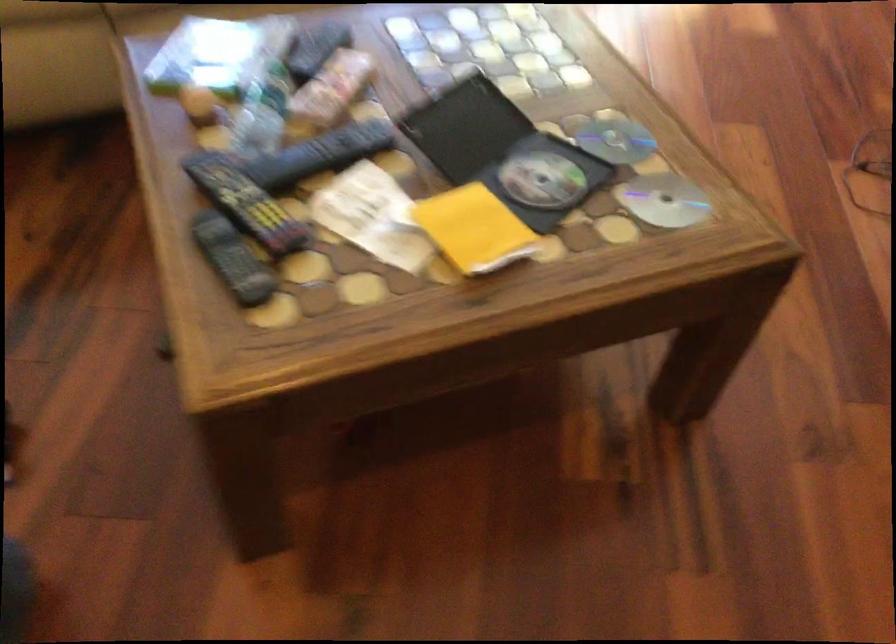
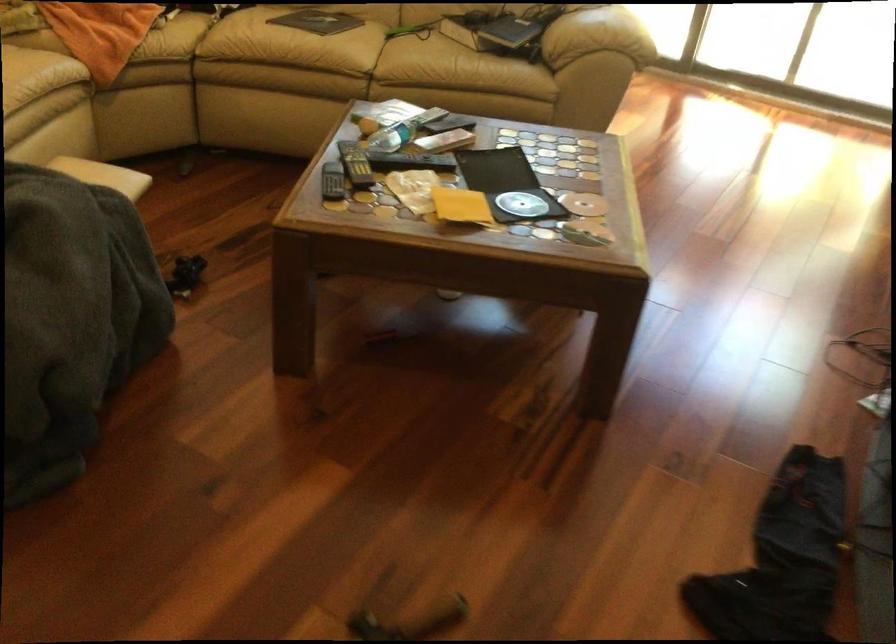
Locate, in the second image, the point that corresponds to point (495, 149) in the first image.

(506, 184)